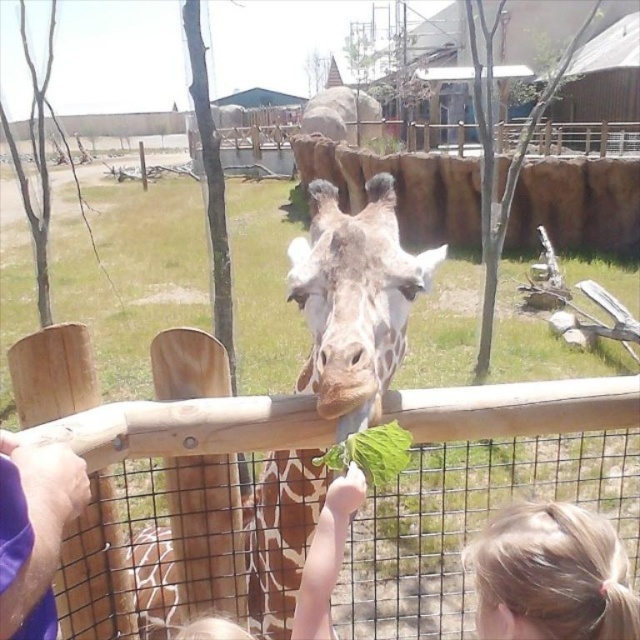
Is wooden fence at center above spotted brown giraffe at center?

Incorrect, wooden fence at center is not positioned above spotted brown giraffe at center.

Is wooden fence at center to the right of spotted brown giraffe at center from the viewer's perspective?

Yes, wooden fence at center is to the right of spotted brown giraffe at center.

Where is `wooden fence at center`? wooden fence at center is located at coordinates (177, 490).

Between blonde hair at upper right and purple fabric hand at lower left, which one has more height?

With more height is blonde hair at upper right.

The height and width of the screenshot is (640, 640). Describe the element at coordinates (552, 576) in the screenshot. I see `blonde hair at upper right` at that location.

Which is behind, point (570, 576) or point (3, 577)?

The point (570, 576) is behind.

At what (x,y) coordinates should I click in order to perform the action: click on blonde hair at upper right. Please return your answer as a coordinate pair (x, y). Looking at the image, I should click on (552, 576).

Between wooden fence at center and purple fabric hand at lower left, which one is positioned higher?

Positioned higher is purple fabric hand at lower left.

Between point (564, 440) and point (51, 536), which one is positioned behind?

The point (564, 440) is more distant.

Where is `wooden fence at center`? This screenshot has height=640, width=640. wooden fence at center is located at coordinates (177, 490).